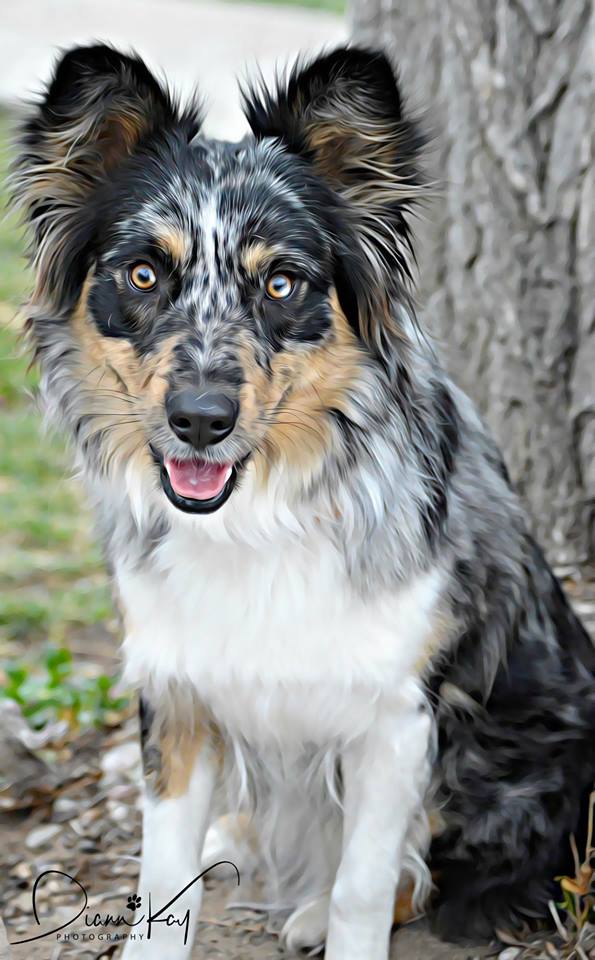
Find the location of a particular element. white fur is located at coordinates click(x=272, y=593).